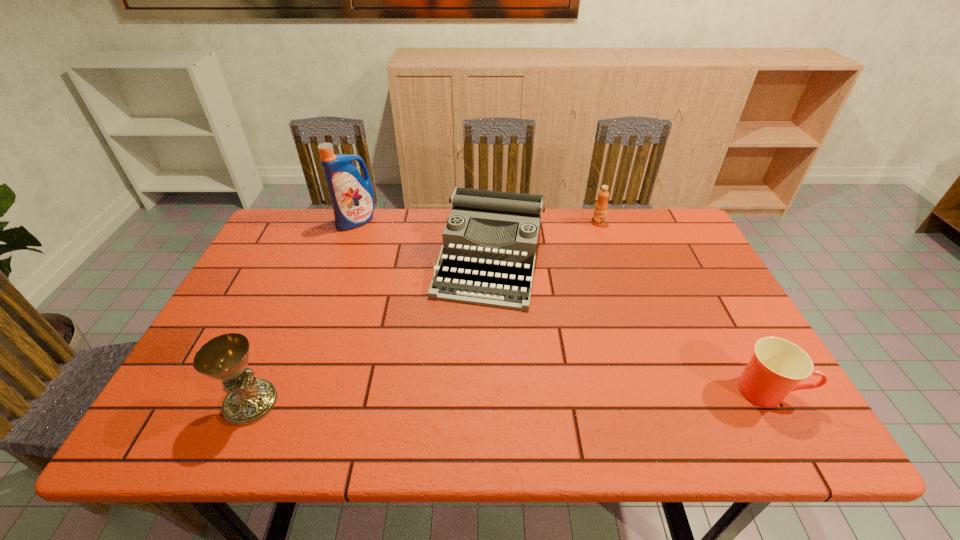
I want to click on object that is the third closest to the tallest object, so [x=601, y=206].

Locate which object is the second closest to the chalice. Please provide its 2D coordinates. Your answer should be formatted as a tuple, i.e. [(x, y)], where the tuple contains the x and y coordinates of a point satisfying the conditions above.

[(352, 197)]

Identify the location of vacant space that satisfies the following two spatial constraints: 1. on the back side of the fourth shortest object; 2. on the right side of the orange juice. (330, 222).

This screenshot has height=540, width=960. What are the coordinates of `vacant area that satisfies the following two spatial constraints: 1. on the back side of the third object from right to left; 2. on the right side of the second object from right to left` in the screenshot? It's located at (489, 222).

I want to click on free spot that satisfies the following two spatial constraints: 1. on the back side of the third object from right to left; 2. on the left side of the second object from right to left, so click(x=489, y=222).